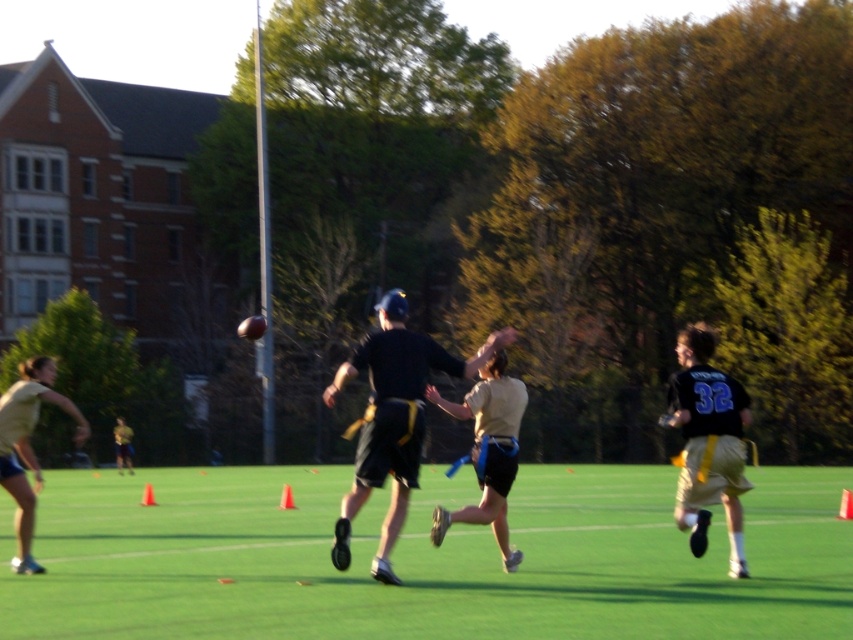
In the scene shown: You are a player in the flag football game and need to locate the ball carrier. You see the black fabric shorts at center. Where would you look to find the ball carrier?

The ball carrier is likely near the black fabric shorts at center, which is located at point [393,419].

You are a player in a flag football game on the field. You need to place a new boundary marker between the green artificial turf at center and the black fabric shorts at center. Which object should the marker be closer to if the marker must be placed closer to the larger object?

The green artificial turf at center is larger in size than the black fabric shorts at center, so the boundary marker should be placed closer to the green artificial turf at center.

You are a drone operator who needs to hover a drone above the green artificial turf at center. What are the coordinates where you should position the drone?

The coordinates for the green artificial turf at center are at point (424, 557), so you should position the drone there.